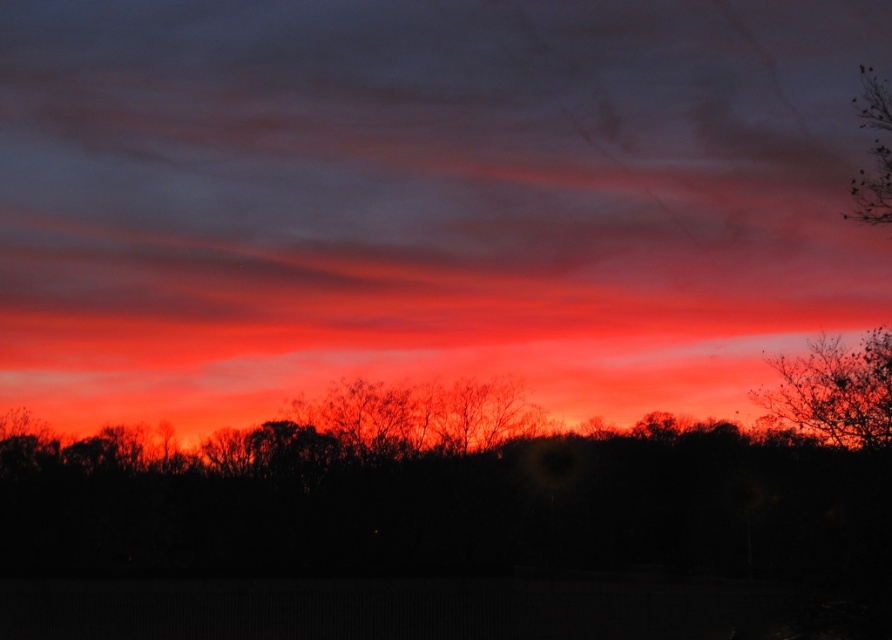
In the sunset scene, there are two silhouettes at the upper right corner of the image. One is labeled as silhouetted bare branches at upper right and the other as silhouette bare tree at upper right. Which of these two silhouettes is shorter?

The silhouetted bare branches at upper right is shorter than the silhouette bare tree at upper right.